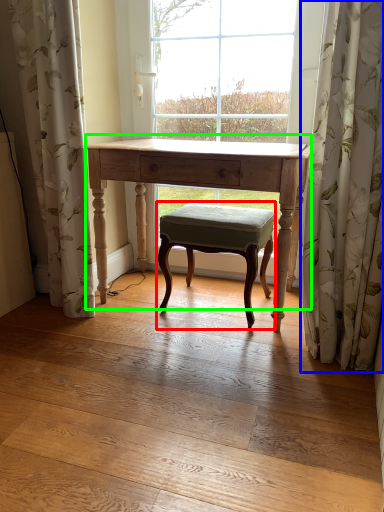
Question: Considering the real-world distances, which object is farthest from stool (highlighted by a red box)? curtain (highlighted by a blue box) or table (highlighted by a green box)?

Choices:
 (A) curtain
 (B) table

Answer: (A)